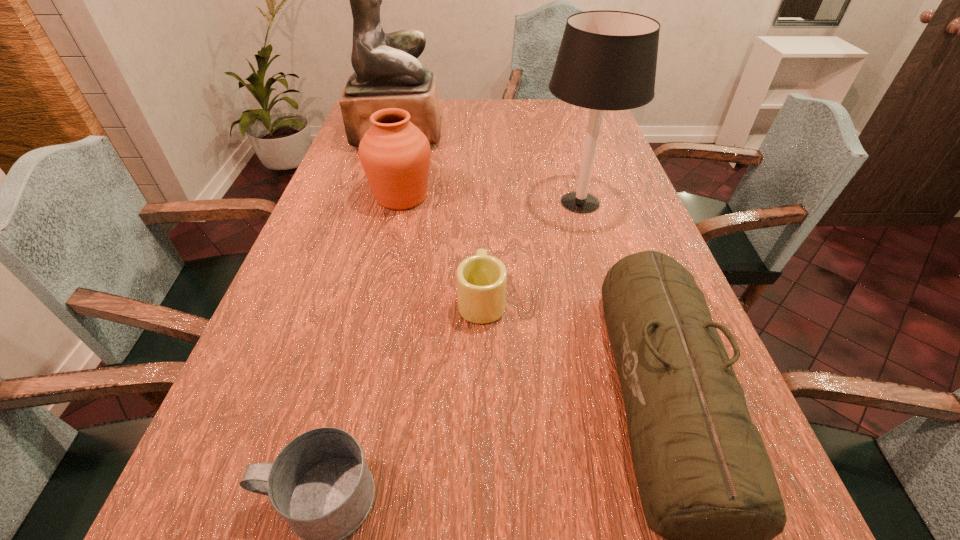
Identify the location of the farthest object. [x=387, y=74].

Where is `sculpture`? Image resolution: width=960 pixels, height=540 pixels. sculpture is located at coordinates (387, 74).

Where is `the fifth shortest object`? The image size is (960, 540). the fifth shortest object is located at coordinates (607, 60).

The width and height of the screenshot is (960, 540). I want to click on urn, so click(x=395, y=155).

The image size is (960, 540). Find the location of `the right mug`. the right mug is located at coordinates [481, 279].

Where is `the farther mug`? Image resolution: width=960 pixels, height=540 pixels. the farther mug is located at coordinates (481, 279).

Where is `free space located in a relaxed pose on the farthest object`? This screenshot has width=960, height=540. free space located in a relaxed pose on the farthest object is located at coordinates (541, 134).

Where is `vacant region located on the back of the table lamp`? Image resolution: width=960 pixels, height=540 pixels. vacant region located on the back of the table lamp is located at coordinates (558, 125).

In order to click on free point located on the right of the urn in this screenshot , I will do `click(467, 197)`.

Where is `vacant space located with the handle on the side of the right mug`? vacant space located with the handle on the side of the right mug is located at coordinates (481, 191).